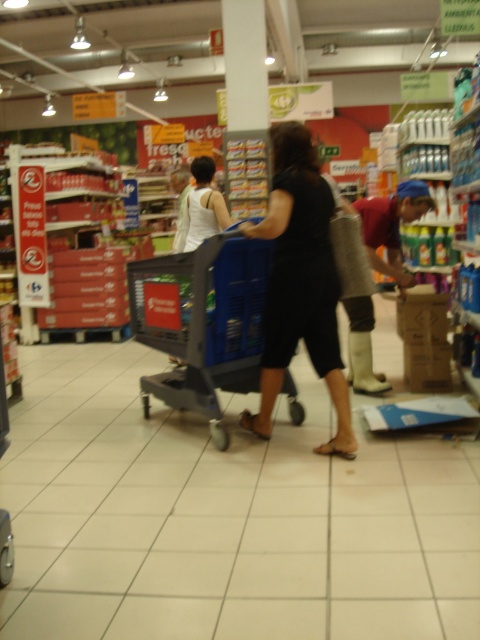
Question: Which of these objects is positioned farthest from the blue plastic trolley at center?

Choices:
 (A) white rubber boots at lower center
 (B) black matte dress at center
 (C) white tank top at center

Answer: (A)

Question: Is white rubber boots at lower center to the right of white tank top at center from the viewer's perspective?

Choices:
 (A) yes
 (B) no

Answer: (A)

Question: Is blue plastic trolley at center smaller than white tank top at center?

Choices:
 (A) no
 (B) yes

Answer: (A)

Question: Which of these objects is positioned closest to the blue plastic trolley at center?

Choices:
 (A) black matte dress at center
 (B) white rubber boots at lower center

Answer: (A)

Question: Estimate the real-world distances between objects in this image. Which object is closer to the black matte dress at center?

Choices:
 (A) blue plastic trolley at center
 (B) white rubber boots at lower center

Answer: (A)

Question: Is black matte dress at center below white rubber boots at lower center?

Choices:
 (A) yes
 (B) no

Answer: (A)